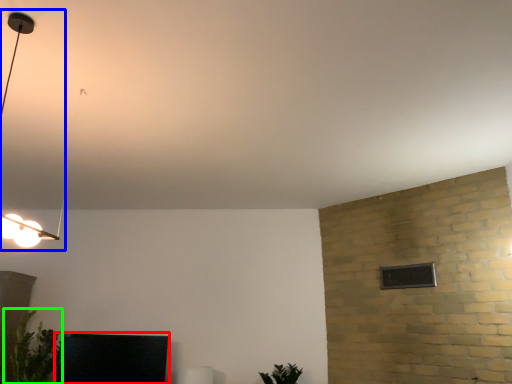
Question: Estimate the real-world distances between objects in this image. Which object is closer to furniture (highlighted by a red box), lamp (highlighted by a blue box) or plant (highlighted by a green box)?

Choices:
 (A) lamp
 (B) plant

Answer: (B)